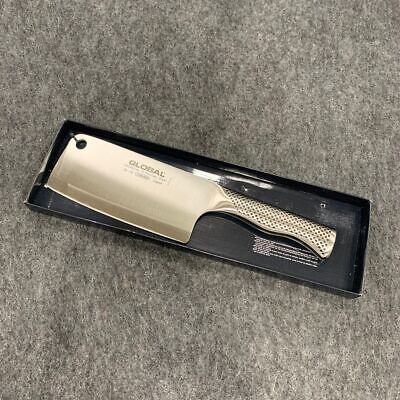
The width and height of the screenshot is (400, 400). Find the location of `hole for hanging`. hole for hanging is located at coordinates click(x=82, y=143).